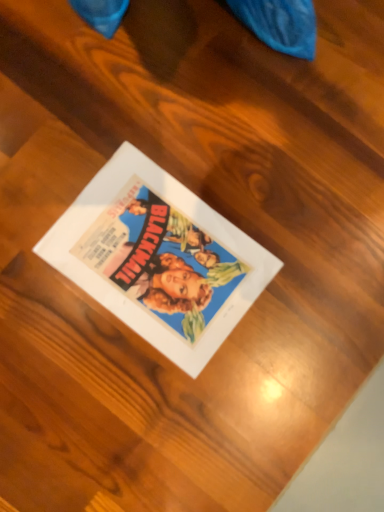
This screenshot has height=512, width=384. What do you see at coordinates (158, 258) in the screenshot? I see `matte paper poster at center` at bounding box center [158, 258].

The width and height of the screenshot is (384, 512). I want to click on matte paper poster at center, so click(x=158, y=258).

This screenshot has width=384, height=512. Find the location of `matte paper poster at center`. matte paper poster at center is located at coordinates (158, 258).